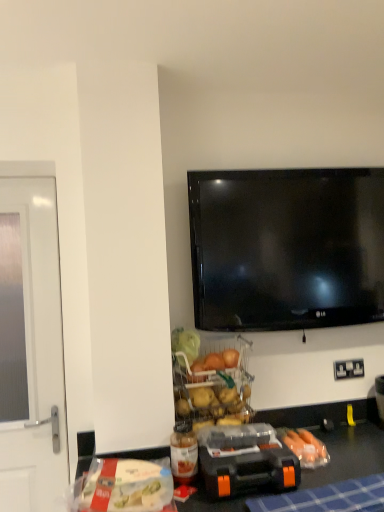
Image resolution: width=384 pixels, height=512 pixels. Find the location of `free spot above black plastic toolbox at lower center (from a real-world perspective)`. free spot above black plastic toolbox at lower center (from a real-world perspective) is located at coordinates (240, 445).